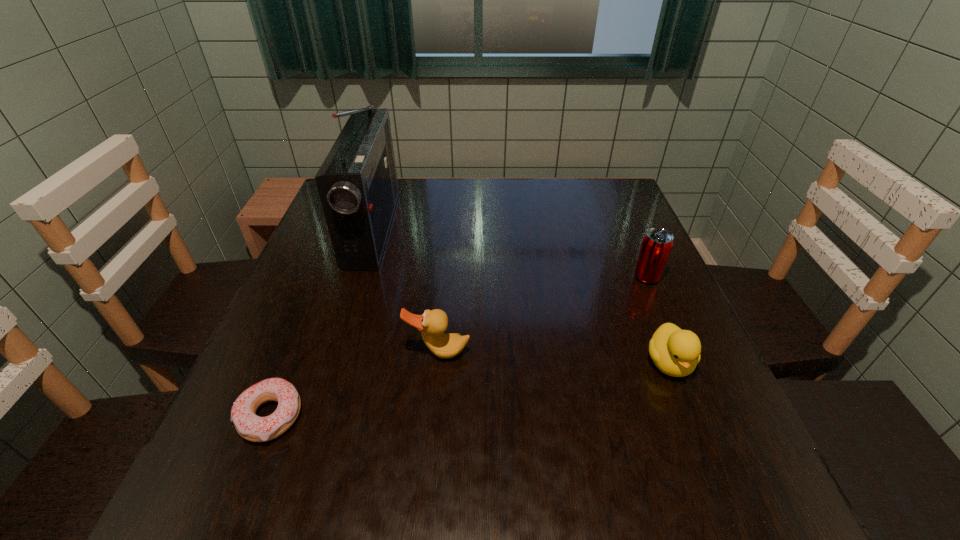
In order to click on free space at the right edge in this screenshot , I will do coord(617,230).

The image size is (960, 540). What are the coordinates of `free location at the far right corner` in the screenshot? It's located at coord(587,183).

Identify the location of vacant space that is in between the radio receiver and the soda can. (510, 253).

Where is `empty space between the tallest object and the right duck`? This screenshot has width=960, height=540. empty space between the tallest object and the right duck is located at coordinates (521, 295).

Find the location of a particular element. The image size is (960, 540). free space between the soda can and the right duck is located at coordinates (658, 320).

I want to click on free spot between the radio receiver and the right duck, so click(521, 295).

This screenshot has height=540, width=960. Find the location of `empty location between the left duck and the tallest object`. empty location between the left duck and the tallest object is located at coordinates (406, 290).

Find the location of `vacant region between the right duck and the tallest object`. vacant region between the right duck and the tallest object is located at coordinates (521, 295).

This screenshot has width=960, height=540. In order to click on vacant space in between the left duck and the radio receiver in this screenshot , I will do `click(406, 290)`.

The width and height of the screenshot is (960, 540). In order to click on vacant space that's between the right duck and the soda can in this screenshot , I will do `click(658, 320)`.